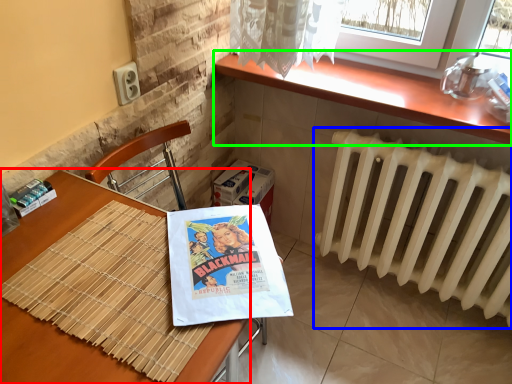
Question: Based on their relative distances, which object is nearer to table (highlighted by a red box)? Choose from radiator (highlighted by a blue box) and counter top (highlighted by a green box).

Choices:
 (A) radiator
 (B) counter top

Answer: (B)